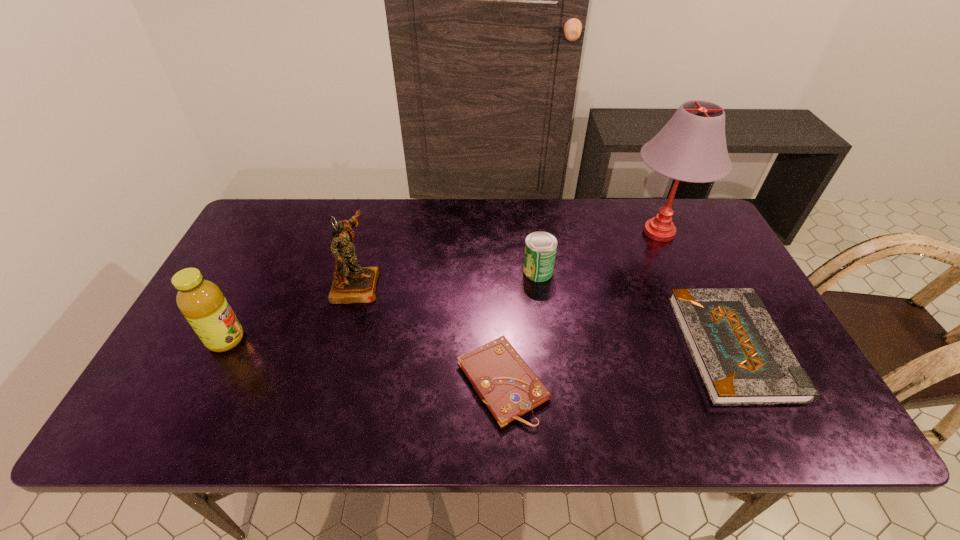
Find the location of a particular element. vacant space in between the fourth tallest object and the leftmost object is located at coordinates (382, 305).

You are a GUI agent. You are given a task and a screenshot of the screen. Output one action in this format:
    pyautogui.click(x=<x>, y=<y>)
    Task: Click on the vacant area that lies between the left notebook and the right notebook
    The width and height of the screenshot is (960, 540).
    Given the screenshot: What is the action you would take?
    pyautogui.click(x=617, y=364)

Locate an element on the screen. free space between the fruit juice and the right notebook is located at coordinates (479, 343).

Identify the location of blank region between the can and the shorter notebook. (520, 326).

Locate an element on the screen. This screenshot has width=960, height=540. vacant area between the can and the table lamp is located at coordinates (598, 252).

This screenshot has width=960, height=540. I want to click on unoccupied position between the left notebook and the right notebook, so click(617, 364).

Locate an element on the screen. Image resolution: width=960 pixels, height=540 pixels. empty space that is in between the figurine and the shortest object is located at coordinates (429, 333).

At what (x,y) coordinates should I click in order to perform the action: click on vacant area between the table lamp and the figurine. Please return your answer as a coordinate pair (x, y). Looking at the image, I should click on (508, 258).

Select which object appears as the fifth closest to the right notebook. Please provide its 2D coordinates. Your answer should be formatted as a tuple, i.e. [(x, y)], where the tuple contains the x and y coordinates of a point satisfying the conditions above.

[(201, 301)]

The width and height of the screenshot is (960, 540). Find the location of `object that stands as the closest to the taller notebook`. object that stands as the closest to the taller notebook is located at coordinates (691, 147).